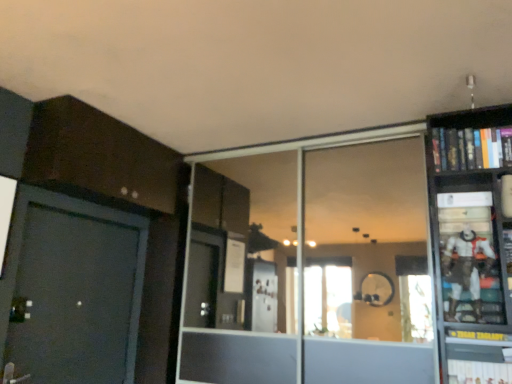
Question: From the image's perspective, is hardcover book at lower right, the 2th book when ordered from top to bottom, under hardcover book at upper right, which is counted as the 2th book, starting from the bottom?

Choices:
 (A) no
 (B) yes

Answer: (B)

Question: Can you confirm if hardcover book at lower right, positioned as the 1th book in bottom-to-top order, is bigger than hardcover book at upper right, which is counted as the 2th book, starting from the bottom?

Choices:
 (A) yes
 (B) no

Answer: (B)

Question: From the image's perspective, is hardcover book at lower right, positioned as the 1th book in bottom-to-top order, located above hardcover book at upper right, which is counted as the 2th book, starting from the bottom?

Choices:
 (A) yes
 (B) no

Answer: (B)

Question: Is hardcover book at lower right, positioned as the 1th book in bottom-to-top order, at the left side of hardcover book at upper right, which is the 1th book in top-to-bottom order?

Choices:
 (A) no
 (B) yes

Answer: (B)

Question: Does hardcover book at lower right, positioned as the 1th book in bottom-to-top order, have a greater width compared to hardcover book at upper right, which is the 1th book in top-to-bottom order?

Choices:
 (A) no
 (B) yes

Answer: (B)

Question: Is hardcover book at lower right, positioned as the 1th book in bottom-to-top order, directly adjacent to hardcover book at upper right, which is counted as the 2th book, starting from the bottom?

Choices:
 (A) no
 (B) yes

Answer: (A)

Question: Is transparent glass door at center in contact with hardcover book at upper right, which is the 1th book in top-to-bottom order?

Choices:
 (A) yes
 (B) no

Answer: (B)

Question: Does transparent glass door at center appear on the left side of hardcover book at upper right, which is the 1th book in top-to-bottom order?

Choices:
 (A) no
 (B) yes

Answer: (B)

Question: Is transparent glass door at center facing towards hardcover book at upper right, which is the 1th book in top-to-bottom order?

Choices:
 (A) yes
 (B) no

Answer: (B)

Question: Considering the relative sizes of transparent glass door at center and hardcover book at upper right, which is counted as the 2th book, starting from the bottom, in the image provided, is transparent glass door at center taller than hardcover book at upper right, which is counted as the 2th book, starting from the bottom,?

Choices:
 (A) yes
 (B) no

Answer: (A)

Question: Considering the relative sizes of transparent glass door at center and hardcover book at upper right, which is the 1th book in top-to-bottom order, in the image provided, is transparent glass door at center shorter than hardcover book at upper right, which is the 1th book in top-to-bottom order,?

Choices:
 (A) no
 (B) yes

Answer: (A)

Question: Is hardcover book at upper right, which is the 1th book in top-to-bottom order, a part of transparent glass door at center?

Choices:
 (A) yes
 (B) no

Answer: (B)

Question: Is hardcover book at lower right, the 2th book when ordered from top to bottom, taller than white matte action figure at right?

Choices:
 (A) yes
 (B) no

Answer: (B)